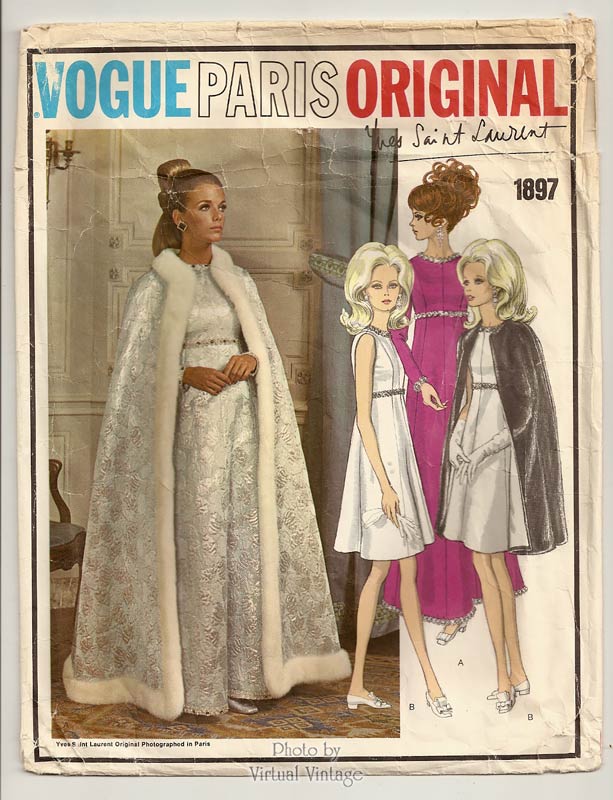
The image size is (613, 800). Identify the location of area to sit. click(58, 530).